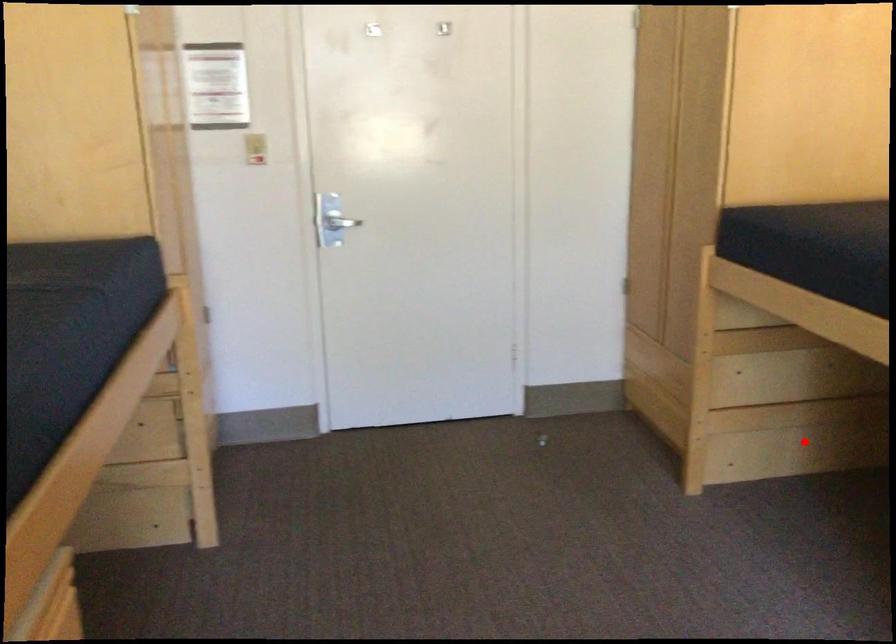
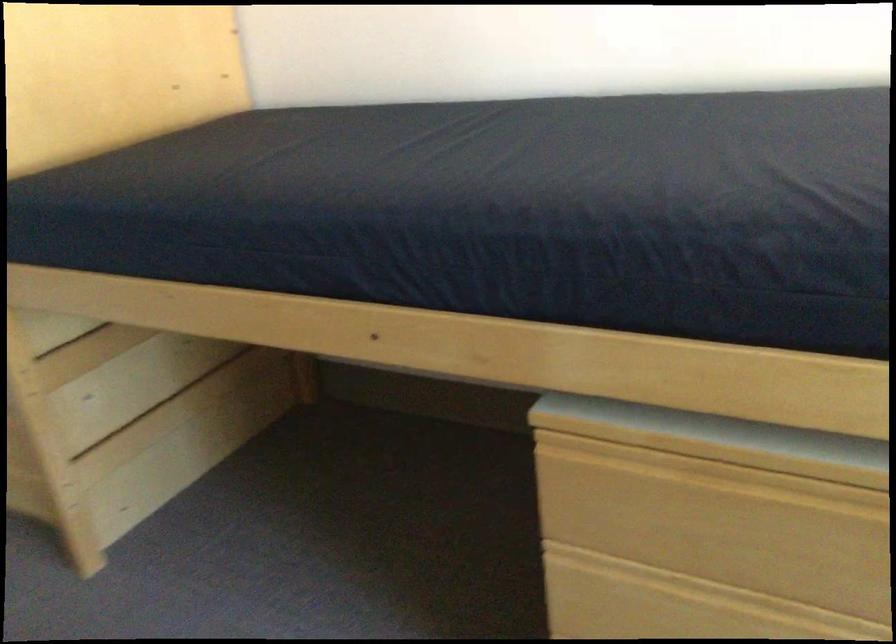
Find the pixel in the second image that matches the highlighted location in the first image.

(195, 444)